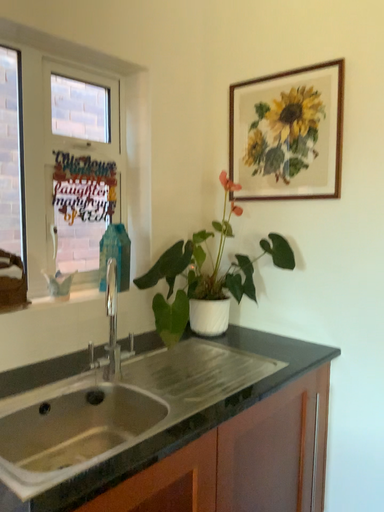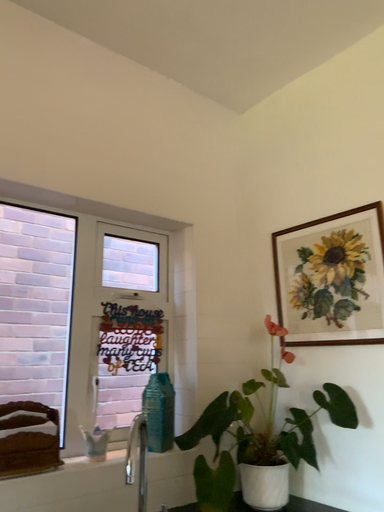
Question: How did the camera likely rotate when shooting the video?

Choices:
 (A) rotated left
 (B) rotated right

Answer: (A)